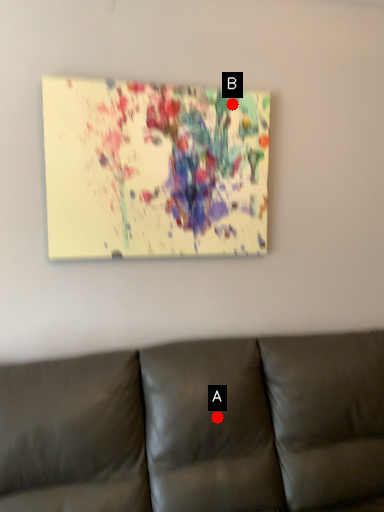
Question: Two points are circled on the image, labeled by A and B beside each circle. Which point is closer to the camera?

Choices:
 (A) A is closer
 (B) B is closer

Answer: (A)